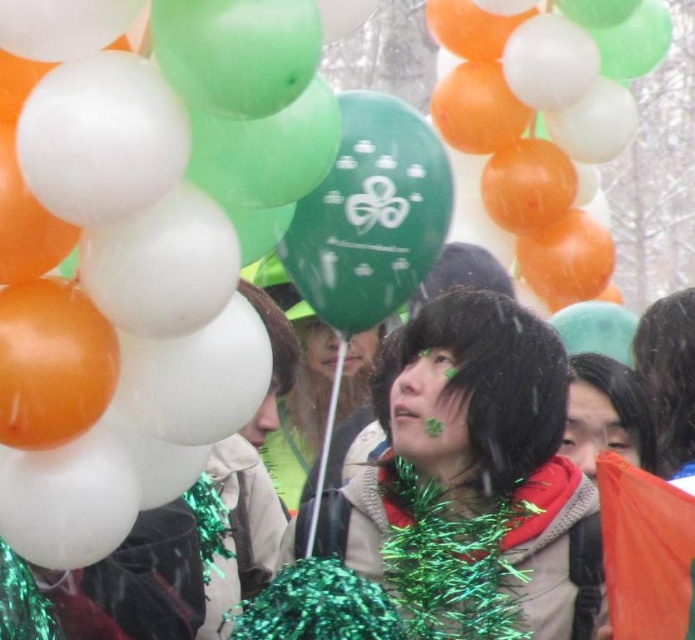
You are organizing a photo shoot and need to adjust the camera focus. The shiny green tinsel at center and the matte black scarf at center are part of the setup. Given that the camera has a depth of field that can clearly capture objects within a 25 feet range, will both items be in focus simultaneously?

The shiny green tinsel at center and the matte black scarf at center are 24.90 feet apart. Since the distance between them is within the camera s 25 feet depth of field range, both items will be in focus simultaneously.

You are attending a St. Patrick Day parade and notice two accessories on a person in the center of the image. The accessories are the shiny green tinsel at center and the matte black scarf at center. Which accessory is positioned lower on the person?

The shiny green tinsel at center is located below the matte black scarf at center, so the shiny green tinsel at center is positioned lower on the person.

You are taking a photo of the festive scene and want to focus on both the point at location (461, 362) and the point at (569, 435). Which point should you adjust your focus to first to ensure it appears clearer in the photo?

Point at (461, 362) should be focused on first because it is closer to the camera, so adjusting focus starting from that point ensures clarity before moving to the point at (569, 435) which is further away.